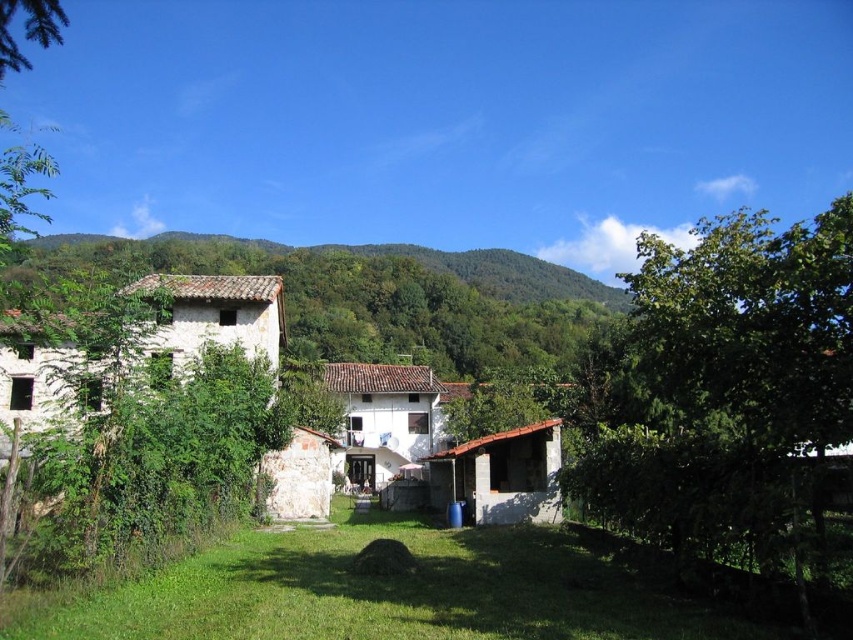
Question: Is green leafy tree at right smaller than green grass at lower center?

Choices:
 (A) no
 (B) yes

Answer: (A)

Question: Does green leafy tree at right appear under green leafy tree at upper left?

Choices:
 (A) no
 (B) yes

Answer: (A)

Question: Which point is closer to the camera?

Choices:
 (A) (764, 356)
 (B) (566, 312)
 (C) (519, 532)
 (D) (28, 29)

Answer: (A)

Question: Is green leafy tree at right above green leafy tree at upper left?

Choices:
 (A) no
 (B) yes

Answer: (B)

Question: Which point appears farthest from the camera in this image?

Choices:
 (A) (415, 259)
 (B) (770, 272)
 (C) (50, 20)

Answer: (A)

Question: Which object appears closest to the camera in this image?

Choices:
 (A) green leafy tree at upper left
 (B) green leafy hillside at left
 (C) green leafy tree at right

Answer: (C)